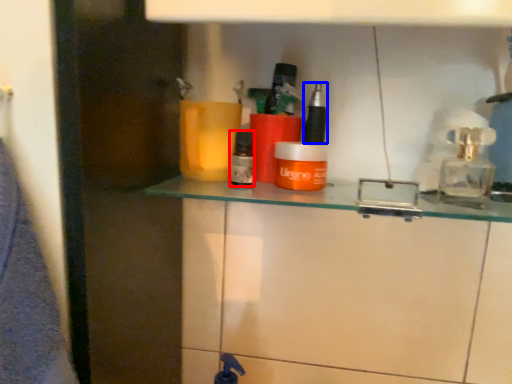
Question: Among these objects, which one is farthest to the camera, toiletry (highlighted by a red box) or toiletry (highlighted by a blue box)?

Choices:
 (A) toiletry
 (B) toiletry

Answer: (B)